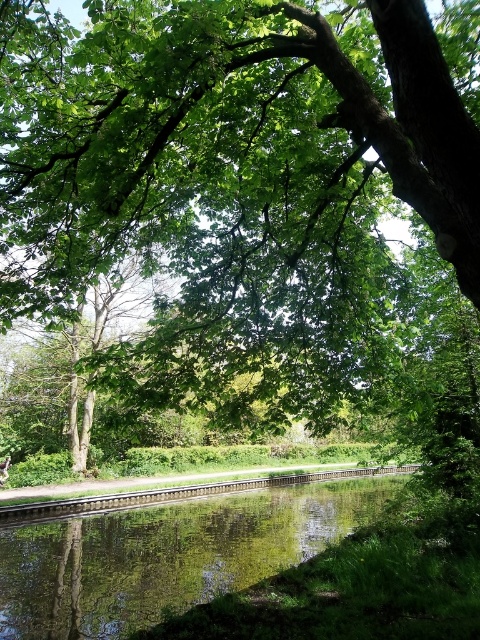
From the picture: You are a train engineer approaching the green wooden train track at center. You need to cross the green reflective water at center. Is the track positioned to the left or right of the water?

The green wooden train track at center is to the right of the green reflective water at center, so the track is positioned to the right of the water.

From the picture: You are standing in the serene natural scene described. You want to take a photo of the green reflective water at center. Where should you aim your camera to capture it?

You should aim your camera at point (166,554) to capture the green reflective water at center.